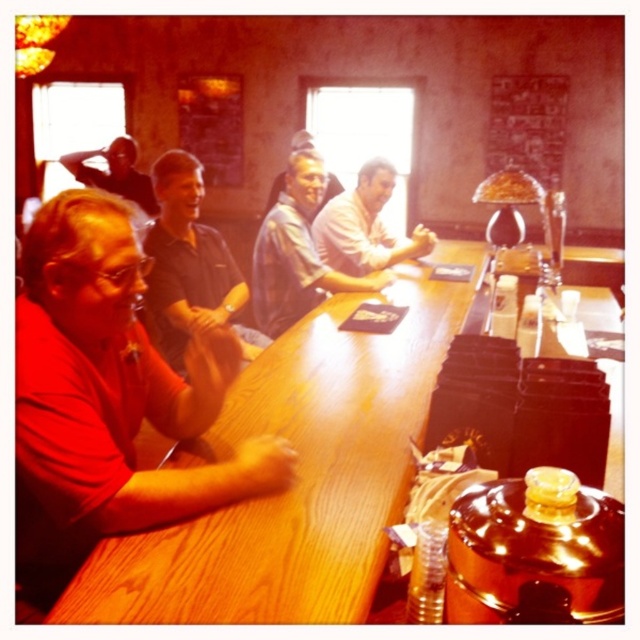
From the picture: Does light blue shirt at center have a lesser height compared to matte blue shirt at center?

In fact, light blue shirt at center may be taller than matte blue shirt at center.

Does light blue shirt at center appear on the right side of matte blue shirt at center?

Indeed, light blue shirt at center is positioned on the right side of matte blue shirt at center.

Find the location of `light blue shirt at center`. light blue shirt at center is located at coordinates click(x=296, y=250).

At what (x,y) coordinates should I click in order to perform the action: click on light blue shirt at center. Please return your answer as a coordinate pair (x, y). The image size is (640, 640). Looking at the image, I should click on (296, 250).

Can you confirm if matte red shirt at left is shorter than light blue shirt at center?

Yes, matte red shirt at left is shorter than light blue shirt at center.

Does point (19, 493) come farther from viewer compared to point (314, 195)?

No, it is not.

The height and width of the screenshot is (640, 640). I want to click on matte red shirt at left, so click(108, 397).

Between point (176, 212) and point (296, 268), which one is positioned behind?

Positioned behind is point (296, 268).

Can you confirm if matte black shirt at center is shorter than light blue shirt at center?

Incorrect, matte black shirt at center's height does not fall short of light blue shirt at center's.

Where is `matte black shirt at center`? The width and height of the screenshot is (640, 640). matte black shirt at center is located at coordinates (186, 260).